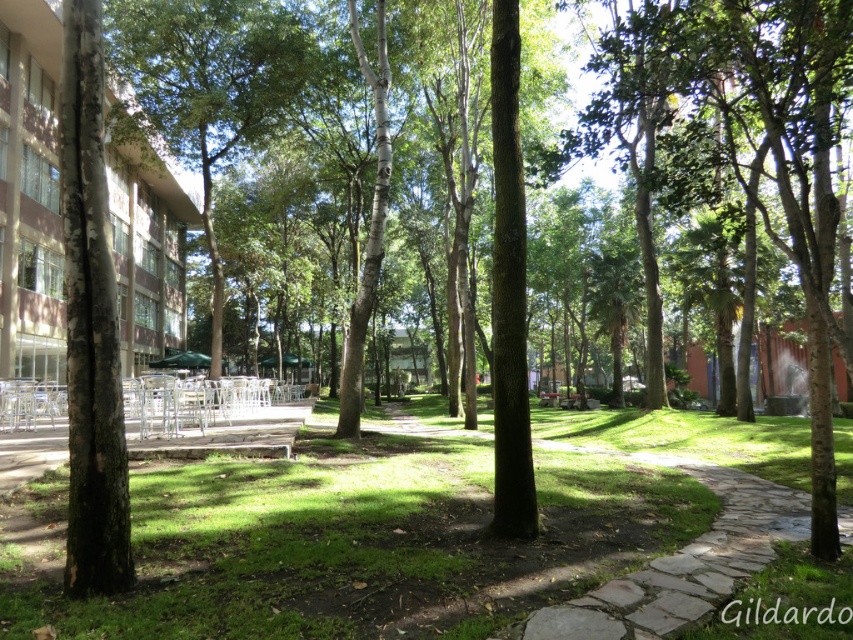
Question: Is green bark tree at left smaller than green leafy tree at center?

Choices:
 (A) yes
 (B) no

Answer: (A)

Question: Is green grass at center to the left of green leafy tree at center from the viewer's perspective?

Choices:
 (A) yes
 (B) no

Answer: (B)

Question: Which of the following is the farthest from the observer?

Choices:
 (A) green bark tree at left
 (B) green grass at center

Answer: (A)

Question: Which of these objects is positioned closest to the green grass at center?

Choices:
 (A) green bark tree at left
 (B) green leafy tree at center

Answer: (A)

Question: Does green grass at center have a greater width compared to green leafy tree at center?

Choices:
 (A) yes
 (B) no

Answer: (A)

Question: Which object appears closest to the camera in this image?

Choices:
 (A) green leafy tree at center
 (B) green bark tree at left
 (C) green grass at center

Answer: (C)